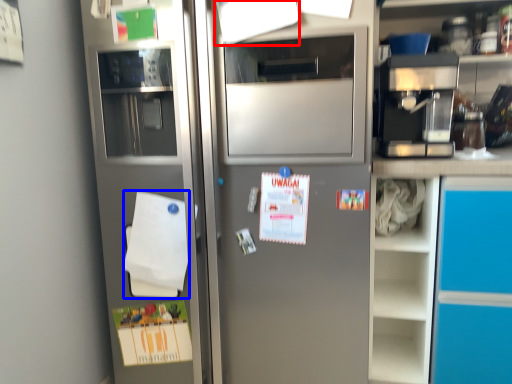
Question: Which point is further to the camera, paper (highlighted by a red box) or notepad (highlighted by a blue box)?

Choices:
 (A) paper
 (B) notepad

Answer: (B)